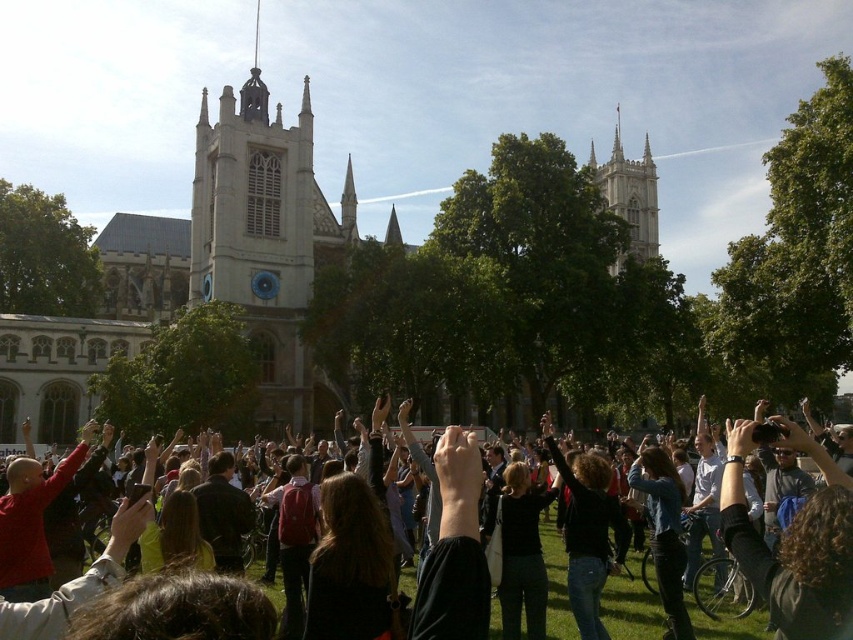
Question: Which is farther from the white stone tower at upper right?

Choices:
 (A) stone church at center
 (B) black fabric at center

Answer: (B)

Question: Estimate the real-world distances between objects in this image. Which object is farther from the dark brown hair at center?

Choices:
 (A) black fabric at center
 (B) white stone tower at upper right
 (C) dark brown leather jacket at center
 (D) stone church at center

Answer: (D)

Question: Does black fabric at center appear on the left side of white stone tower at upper right?

Choices:
 (A) yes
 (B) no

Answer: (A)

Question: Is black fabric at center to the left of white stone tower at upper right from the viewer's perspective?

Choices:
 (A) no
 (B) yes

Answer: (B)

Question: Which point is closer to the camera?

Choices:
 (A) white stone tower at upper right
 (B) black fabric at center
 (C) stone church at center
 (D) dark brown leather jacket at center

Answer: (D)

Question: Does dark brown hair at center have a larger size compared to black fabric at center?

Choices:
 (A) no
 (B) yes

Answer: (B)